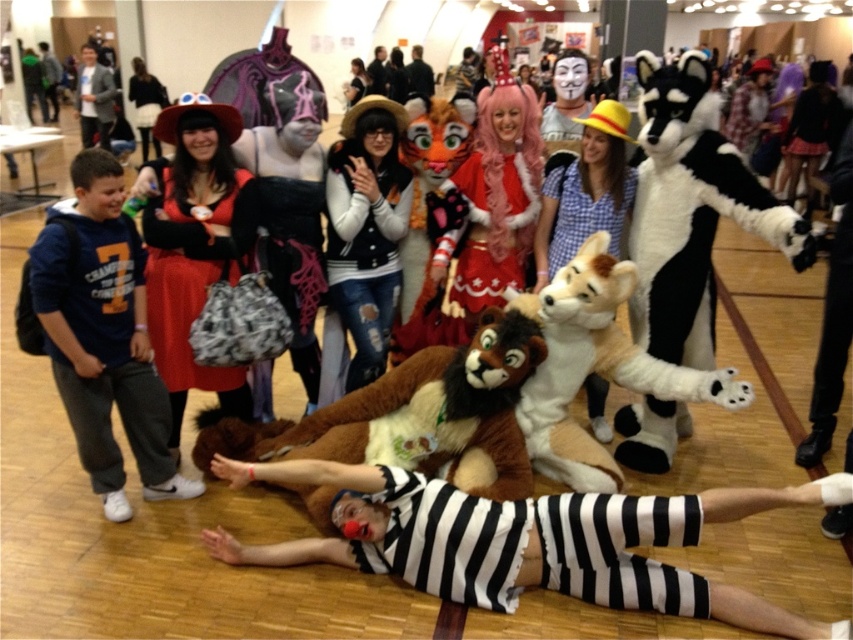
You are a photographer at this event and want to ensure both the white fleece vest at center and the velvet red dress at center are visible in your photo. Given their height difference, which one might you need to adjust the camera angle for to capture both properly?

The white fleece vest at center is taller than the velvet red dress at center. To capture both properly, you might need to lower the camera angle slightly to ensure the taller white fleece vest at center doesn not block the shorter velvet red dress at center.

You are standing at the center of the convention hall and see the point marked at coordinate (x=692, y=211). What object is located at that point?

The point marked at coordinate (x=692, y=211) is the location of the black and white plush raccoon at center.

You are a photographer at the event and want to capture a photo that includes both the black and white plush raccoon at center and the brown furry stuffed animal at center. Which object should you focus on first if you want to ensure both are in the frame?

The black and white plush raccoon at center is located above the brown furry stuffed animal at center, so you should focus on the brown furry stuffed animal at center first to ensure both are in the frame.